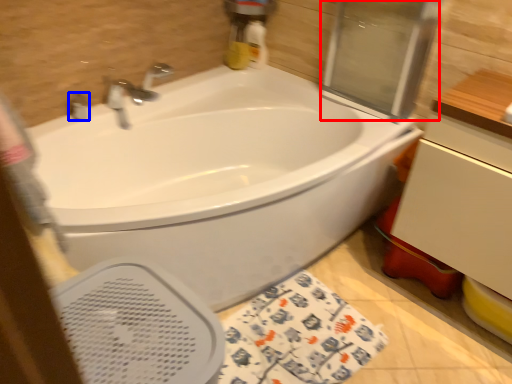
Question: Which object appears farthest to the camera in this image, screen door (highlighted by a red box) or plumbing fixture (highlighted by a blue box)?

Choices:
 (A) screen door
 (B) plumbing fixture

Answer: (B)